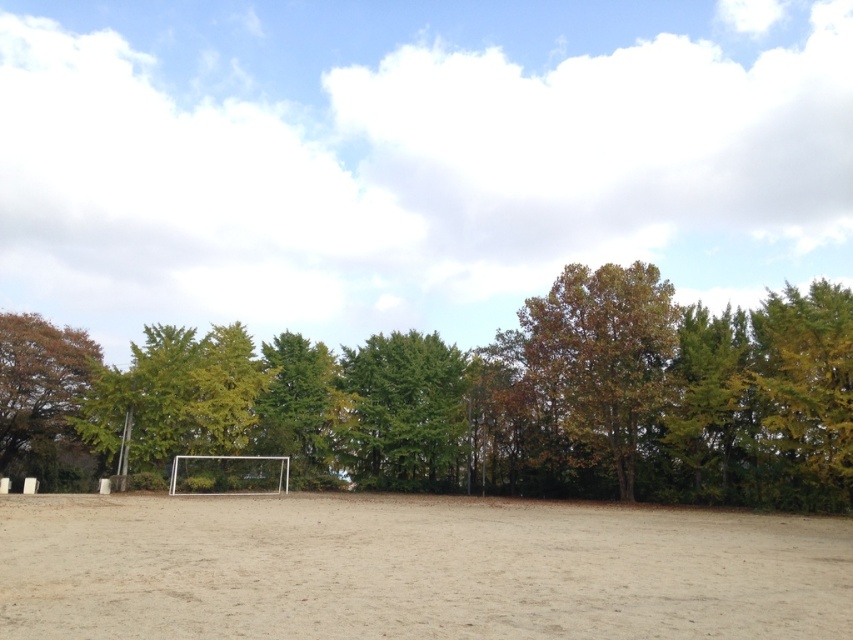
You are standing at the edge of the sandy area and want to walk to the tree. Which direction should you head to reach the brown leafy tree at left from the brown sandy ground at center?

Since the brown sandy ground at center is closer to the viewer than the brown leafy tree at left, you should head left towards the brown leafy tree at left to reach it.

You are standing in the outdoor area and want to walk from the brown leafy tree at left to the brown sandy ground at center. Which direction should you move?

To move from the brown leafy tree at left to the brown sandy ground at center, you should move to the right since the brown sandy ground at center is located to the right of the brown leafy tree at left.